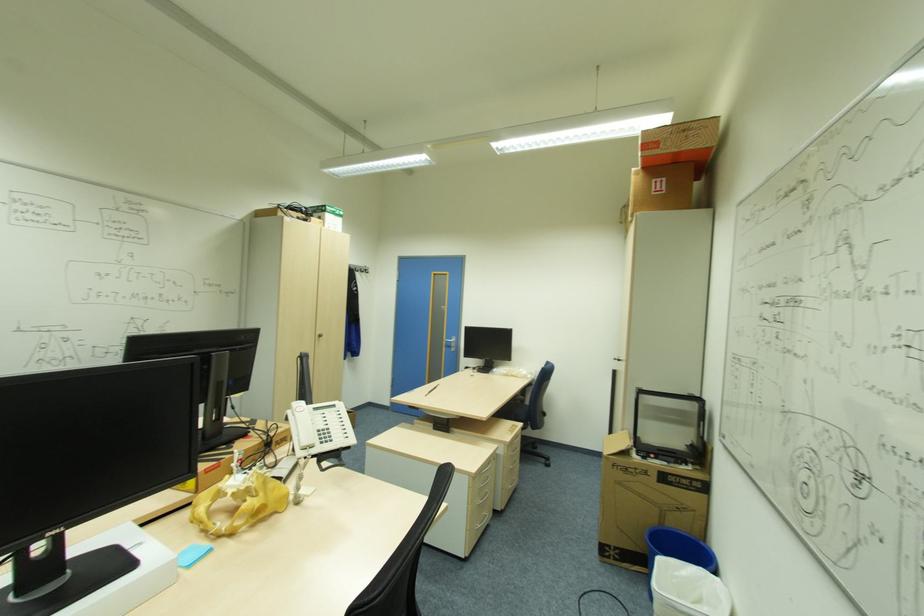
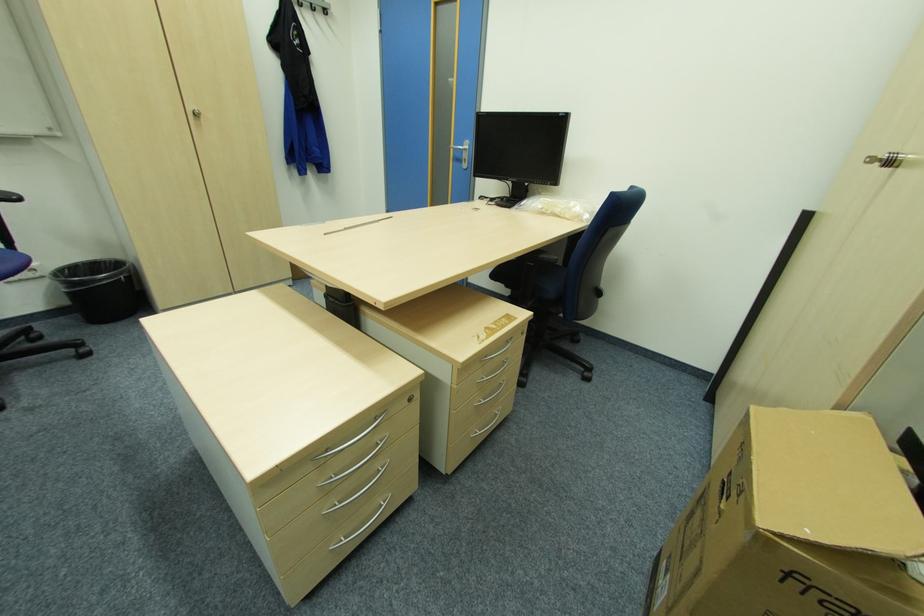
Find the pixel in the second image that matches pixel 616 464 in the first image.

(789, 573)